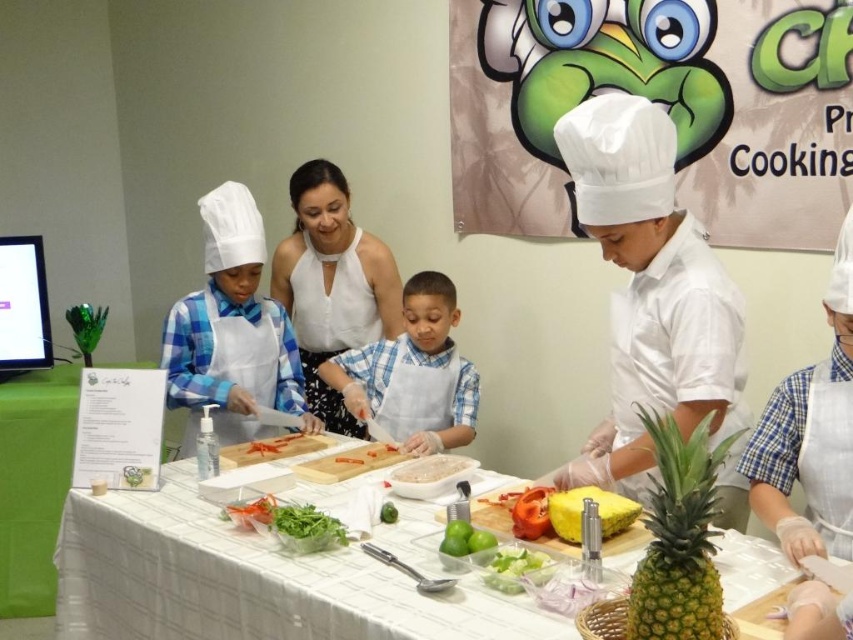
Question: Which of these objects is positioned farthest from the white plastic table at center?

Choices:
 (A) matte white chef hat at center
 (B) green leafy salad at center
 (C) green textured pineapple at center

Answer: (A)

Question: Can you confirm if green textured pineapple at center is thinner than yellow rubber gloves at center?

Choices:
 (A) no
 (B) yes

Answer: (B)

Question: Which point is closer to the camera taking this photo?

Choices:
 (A) (498, 572)
 (B) (263, 499)
 (C) (691, 621)
 (D) (447, 476)

Answer: (C)

Question: Which of the following is the closest to the observer?

Choices:
 (A) translucent plastic bag at center
 (B) green textured pineapple at center
 (C) green leafy vegetable at center

Answer: (B)

Question: Observing the image, what is the correct spatial positioning of matte white chef hat at center in reference to white plastic cutting board at center?

Choices:
 (A) right
 (B) left

Answer: (B)

Question: Can you confirm if white plastic table at center is positioned to the left of white plastic cutting board at center?

Choices:
 (A) no
 (B) yes

Answer: (B)